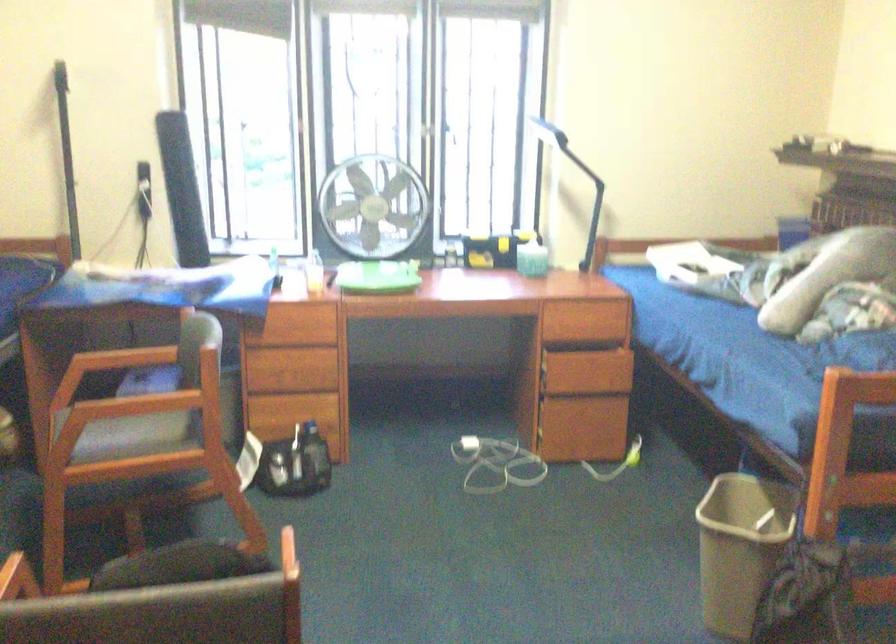
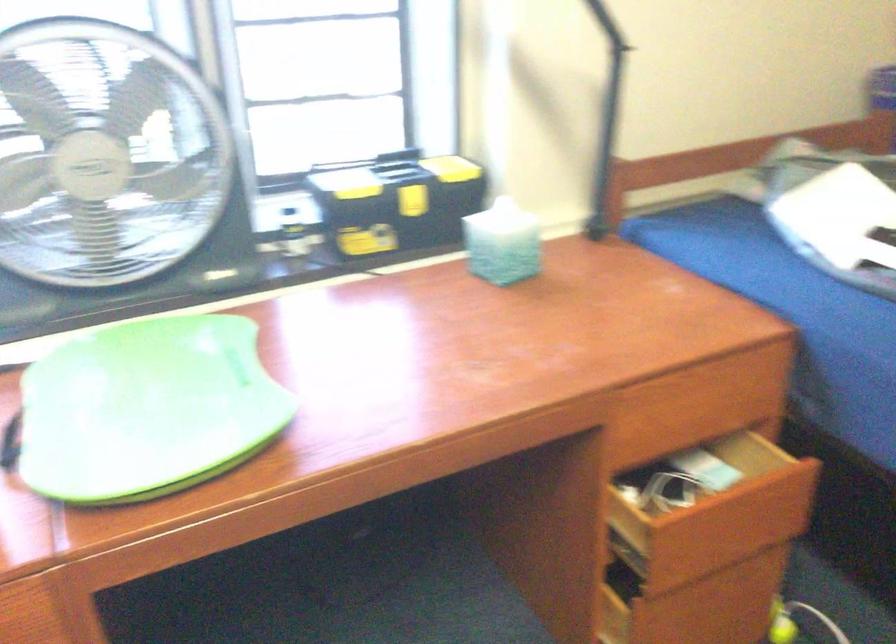
In the second image, find the point that corresponds to (x=591, y=368) in the first image.

(721, 526)